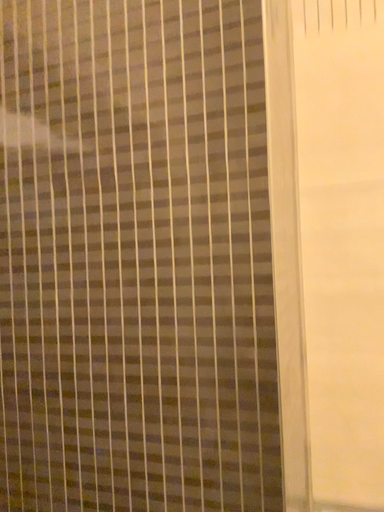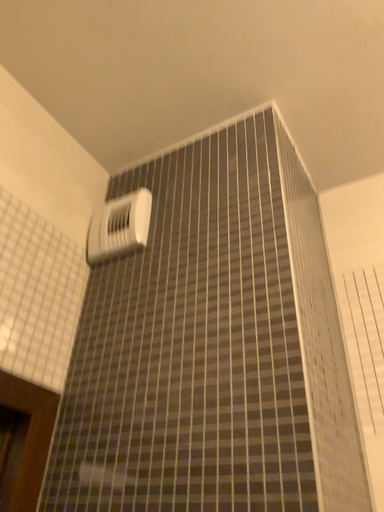
Question: Which way did the camera rotate in the video?

Choices:
 (A) rotated right
 (B) rotated left

Answer: (B)